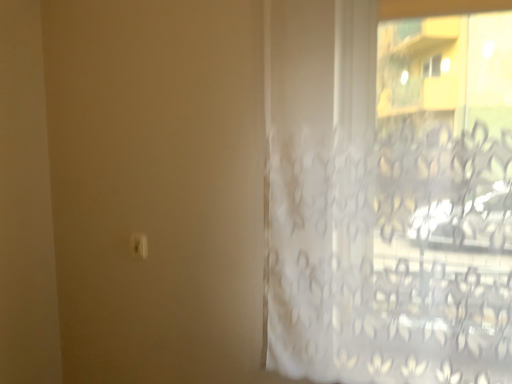
Question: Should I look upward or downward to see silver metallic door handle at lower left?

Choices:
 (A) up
 (B) down

Answer: (B)